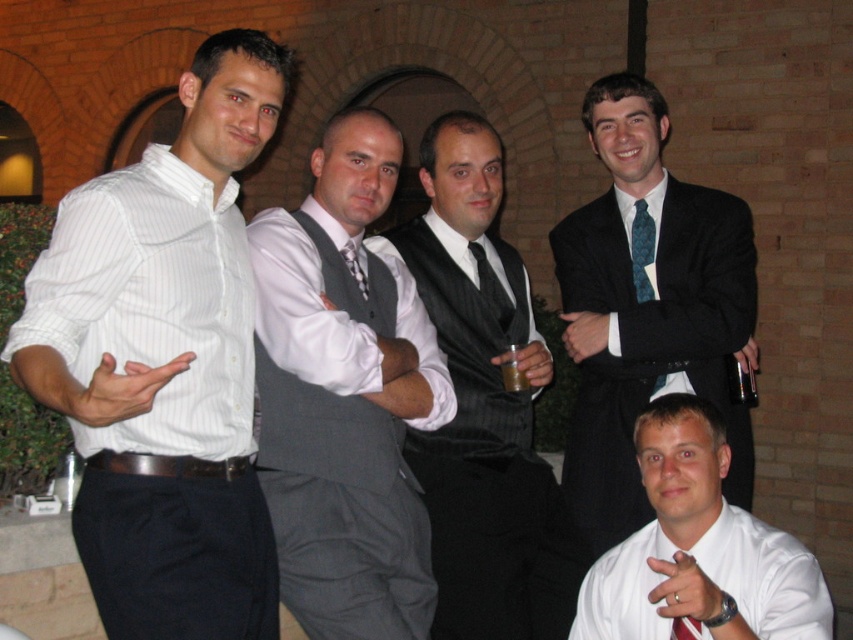
You are standing at the camera position and need to throw a ball to hit the gray fabric vest at center. What is the minimum distance you need to throw the ball?

The minimum distance you need to throw the ball is 16.50 feet to reach the gray fabric vest at center.

You are organizing a charity event and need to ensure that the attire of the guests matches the theme. The theme requires that the vest must be smaller than the tie. Given the image, will the matte black vest at center and the red silk tie at lower right meet the theme requirements?

The matte black vest at center has a larger size compared to the red silk tie at lower right, so they do not meet the theme requirement that the vest must be smaller than the tie.